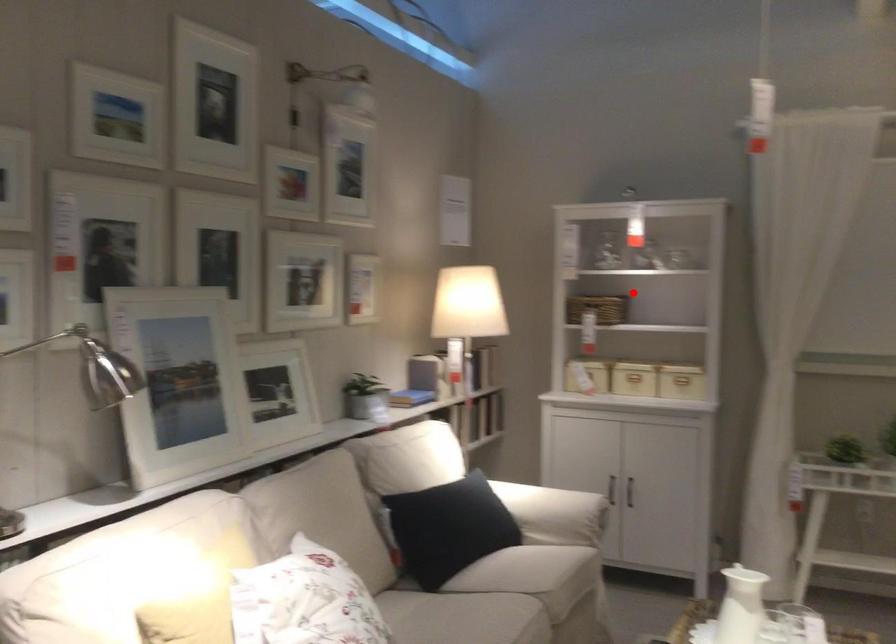
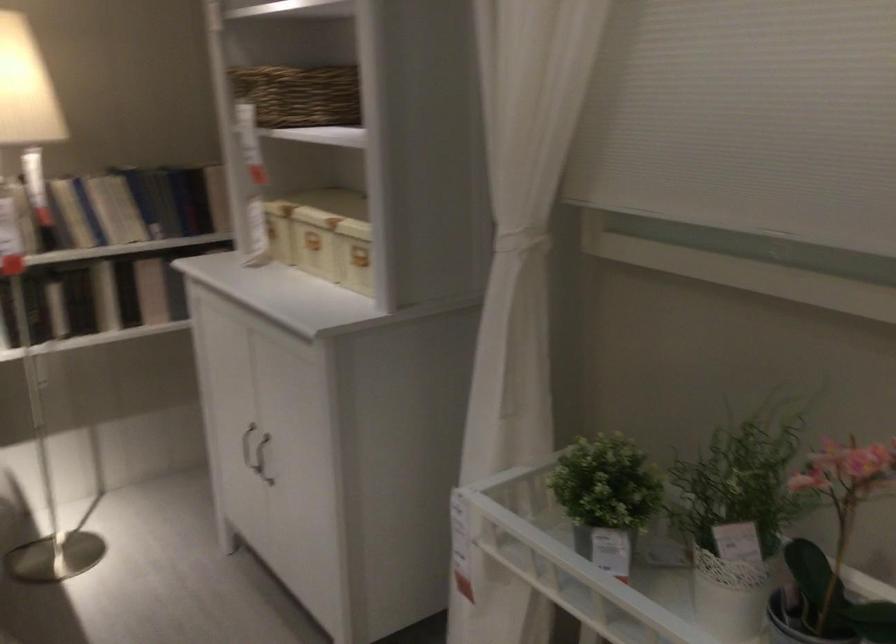
Question: I am providing you with two images of the same scene from different viewpoints. Image1 has a red point marked. In image2, the corresponding 3D location appears at what relative position? Reply with the corresponding letter.

Choices:
 (A) Closer
 (B) Farther

Answer: (A)